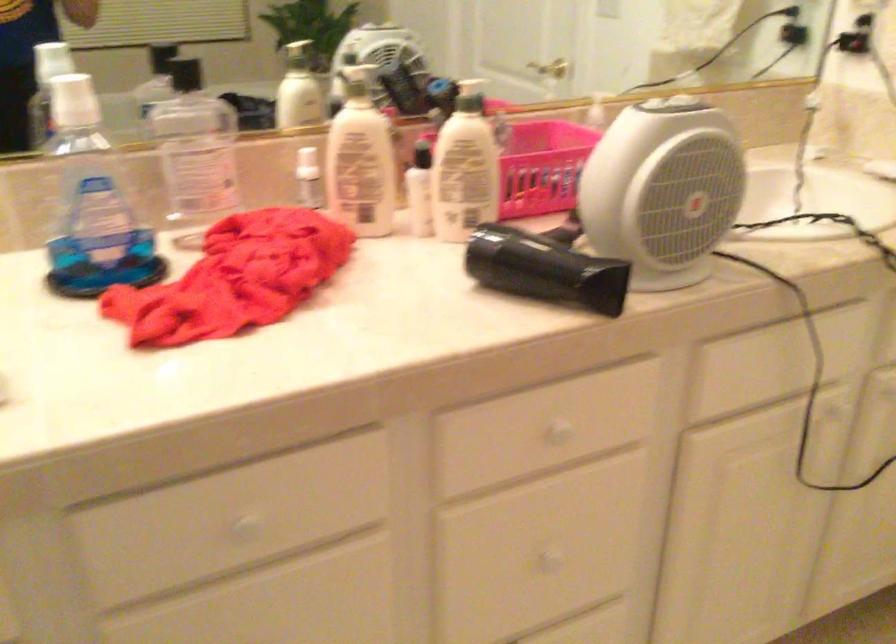
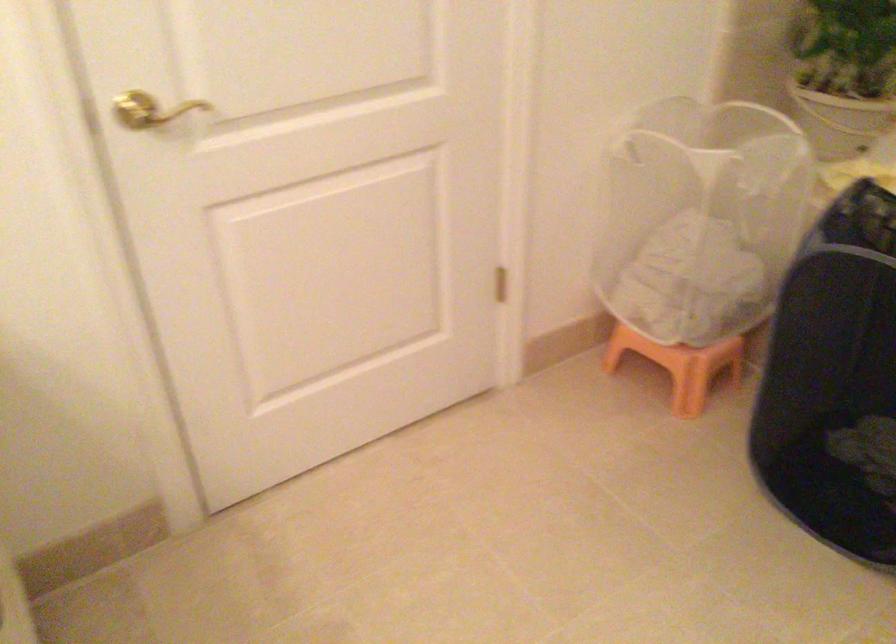
How did the camera likely rotate?

The camera's rotation is toward right-down.